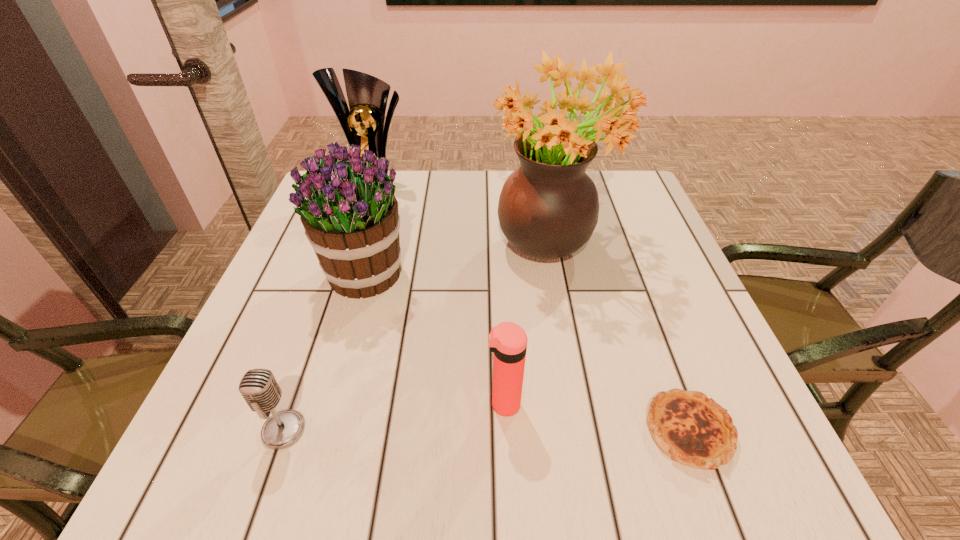
What are the coordinates of `vacant space located 0.150m on the back of the microphone` in the screenshot? It's located at (315, 340).

Where is `free spot located on the left of the shortest object`? free spot located on the left of the shortest object is located at coordinates (590, 431).

This screenshot has width=960, height=540. Identify the location of flower arrangement at the far edge. (548, 208).

Identify the location of award located at the far edge. This screenshot has width=960, height=540. (363, 125).

Image resolution: width=960 pixels, height=540 pixels. I want to click on microphone that is at the near edge, so click(x=259, y=388).

Identify the location of quiche at the near edge. The width and height of the screenshot is (960, 540). (692, 429).

The height and width of the screenshot is (540, 960). I want to click on award that is at the left edge, so click(x=363, y=125).

You are a GUI agent. You are given a task and a screenshot of the screen. Output one action in this format:
    pyautogui.click(x=<x>, y=<y>)
    Task: Click on the bouquet positioned at the left edge
    The image size is (960, 540).
    Given the screenshot: What is the action you would take?
    pyautogui.click(x=350, y=215)

Where is `microphone that is at the left edge`? This screenshot has height=540, width=960. microphone that is at the left edge is located at coordinates (259, 388).

Where is `flower arrangement at the right edge`? This screenshot has height=540, width=960. flower arrangement at the right edge is located at coordinates (548, 208).